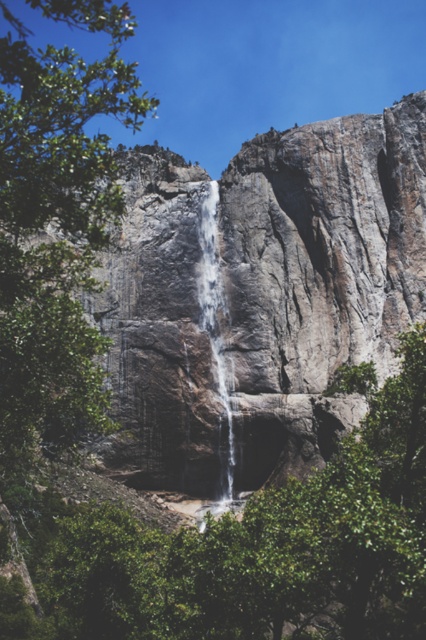
Is point (420, 365) positioned after point (210, 216)?

No, it is not.

Does green leafy tree at center have a lesser width compared to clear water at center?

No.

At what (x,y) coordinates should I click in order to perform the action: click on green leafy tree at center. Please return your answer as a coordinate pair (x, y). Looking at the image, I should click on pos(255,547).